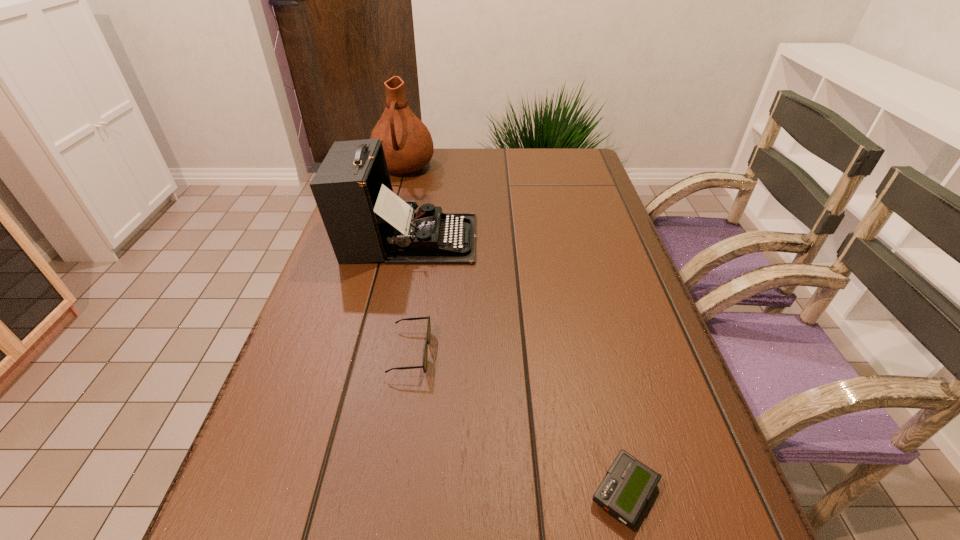
In order to click on object present at the far edge in this screenshot , I will do `click(407, 143)`.

You are a GUI agent. You are given a task and a screenshot of the screen. Output one action in this format:
    pyautogui.click(x=<x>, y=<y>)
    Task: Click on the pitcher that is positioned at the left edge
    Image resolution: width=960 pixels, height=540 pixels.
    Given the screenshot: What is the action you would take?
    pyautogui.click(x=407, y=143)

The height and width of the screenshot is (540, 960). I want to click on typewriter that is at the left edge, so click(365, 221).

The image size is (960, 540). In order to click on object that is at the right edge in this screenshot , I will do `click(628, 485)`.

Where is `object that is at the far left corner`? object that is at the far left corner is located at coordinates 407,143.

This screenshot has height=540, width=960. In the image, there is a desktop. Find the location of `free space at the far edge`. free space at the far edge is located at coordinates (534, 159).

Find the location of a particular element. The width and height of the screenshot is (960, 540). vacant area at the left edge is located at coordinates (341, 390).

You are a GUI agent. You are given a task and a screenshot of the screen. Output one action in this format:
    pyautogui.click(x=<x>, y=<y>)
    Task: Click on the free location at the right edge
    
    Given the screenshot: What is the action you would take?
    pyautogui.click(x=701, y=510)

The image size is (960, 540). In order to click on vacant region at the far right corner of the desktop in this screenshot , I will do `click(559, 151)`.

In order to click on free spot between the rightmost object and the pitcher in this screenshot , I will do `click(515, 330)`.